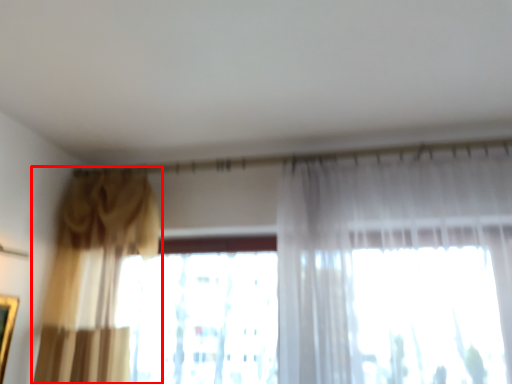
Question: Where is curtain (annotated by the red box) located in relation to window in the image?

Choices:
 (A) left
 (B) right

Answer: (A)